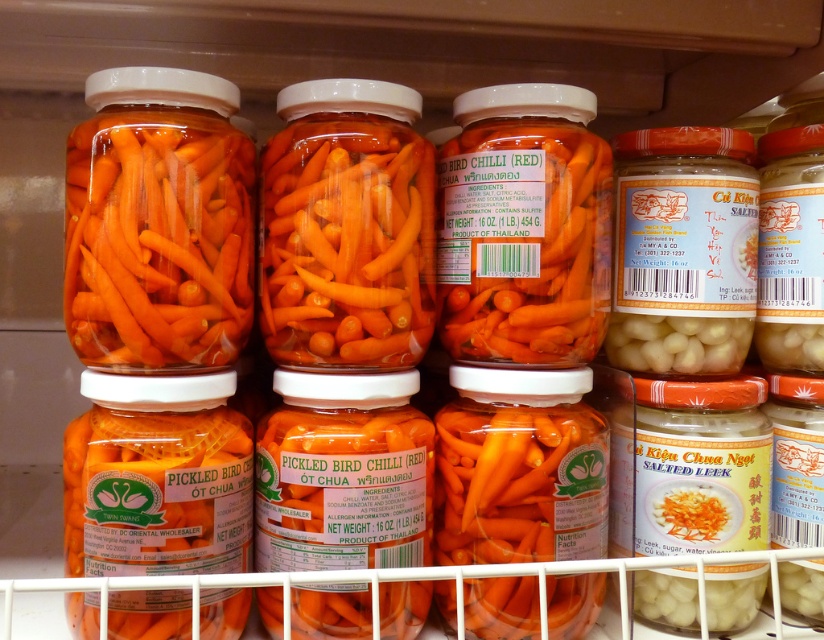
Question: Which point appears farthest from the camera in this image?

Choices:
 (A) (485, 275)
 (B) (377, 348)

Answer: (A)

Question: Based on their relative distances, which object is nearer to the translucent glass jar of salted leek at center?

Choices:
 (A) white matte glass jar at right
 (B) orange glossy pickled bird chilli at center

Answer: (A)

Question: Can you confirm if orange glossy pickled carrots at center is positioned to the right of bright orange pickled carrots at center?

Choices:
 (A) no
 (B) yes

Answer: (A)

Question: In this image, where is orange glossy pickled carrots at center located relative to bright orange pickled carrots at center?

Choices:
 (A) right
 (B) left

Answer: (B)

Question: Which point is closer to the camera?

Choices:
 (A) bright orange pickled carrots at center
 (B) white matte glass jar at right
 (C) translucent glass jar of salted leek at center
 (D) orange glossy pickled carrots at center

Answer: (D)

Question: Is orange glossy pickled carrots at center wider than orange glossy pickled bird chilli at center?

Choices:
 (A) no
 (B) yes

Answer: (B)